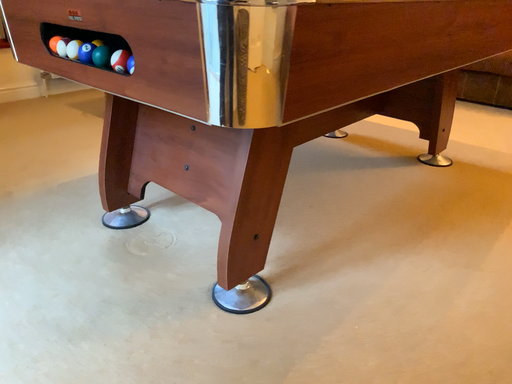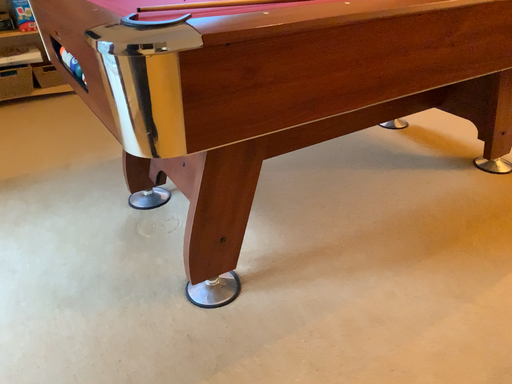
Question: Which way did the camera rotate in the video?

Choices:
 (A) rotated left
 (B) rotated right

Answer: (A)